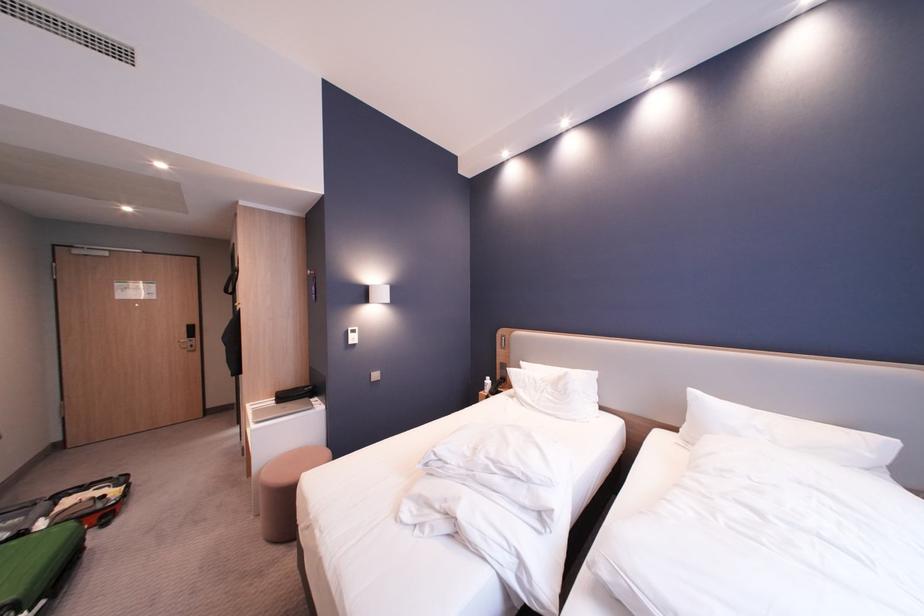
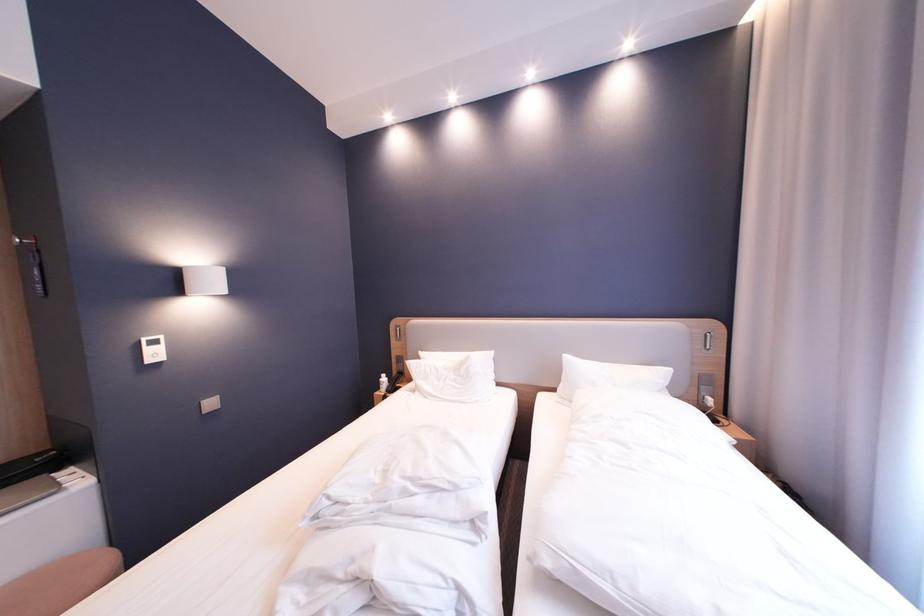
Find the pixel in the second image that matches point (546, 392) in the first image.

(450, 382)